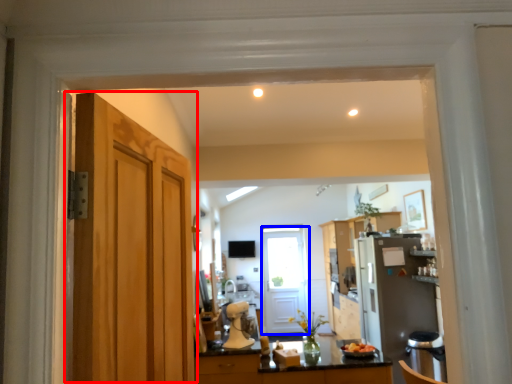
Question: Which of the following is the farthest to the observer, door (highlighted by a red box) or door (highlighted by a blue box)?

Choices:
 (A) door
 (B) door

Answer: (B)